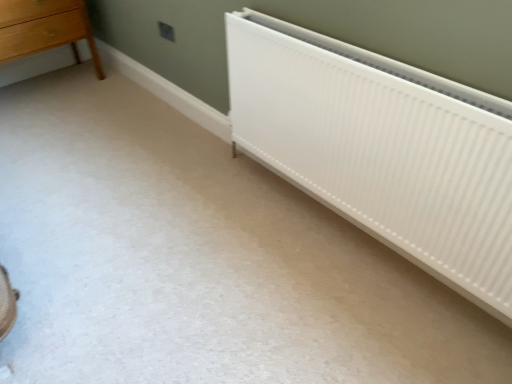
Question: Is white ribbed radiator at lower right far from light brown wooden chest of drawers at upper left?

Choices:
 (A) no
 (B) yes

Answer: (B)

Question: Considering the relative positions of white ribbed radiator at lower right and light brown wooden chest of drawers at upper left in the image provided, is white ribbed radiator at lower right to the left of light brown wooden chest of drawers at upper left from the viewer's perspective?

Choices:
 (A) no
 (B) yes

Answer: (A)

Question: Does white ribbed radiator at lower right have a larger size compared to light brown wooden chest of drawers at upper left?

Choices:
 (A) no
 (B) yes

Answer: (A)

Question: Is white ribbed radiator at lower right oriented towards light brown wooden chest of drawers at upper left?

Choices:
 (A) no
 (B) yes

Answer: (A)

Question: Considering the relative sizes of white ribbed radiator at lower right and light brown wooden chest of drawers at upper left in the image provided, is white ribbed radiator at lower right taller than light brown wooden chest of drawers at upper left?

Choices:
 (A) no
 (B) yes

Answer: (B)

Question: Considering the relative sizes of white ribbed radiator at lower right and light brown wooden chest of drawers at upper left in the image provided, is white ribbed radiator at lower right shorter than light brown wooden chest of drawers at upper left?

Choices:
 (A) yes
 (B) no

Answer: (B)

Question: Does light brown wooden chest of drawers at upper left have a larger size compared to white ribbed radiator at lower right?

Choices:
 (A) yes
 (B) no

Answer: (A)

Question: Can you confirm if light brown wooden chest of drawers at upper left is shorter than white ribbed radiator at lower right?

Choices:
 (A) no
 (B) yes

Answer: (B)

Question: Is light brown wooden chest of drawers at upper left in contact with white ribbed radiator at lower right?

Choices:
 (A) no
 (B) yes

Answer: (A)

Question: Is the depth of light brown wooden chest of drawers at upper left less than that of white ribbed radiator at lower right?

Choices:
 (A) no
 (B) yes

Answer: (A)

Question: From the image's perspective, is light brown wooden chest of drawers at upper left on top of white ribbed radiator at lower right?

Choices:
 (A) yes
 (B) no

Answer: (A)

Question: From the image's perspective, does light brown wooden chest of drawers at upper left appear lower than white ribbed radiator at lower right?

Choices:
 (A) yes
 (B) no

Answer: (B)

Question: Looking at their shapes, would you say white ribbed radiator at lower right is wider or thinner than light brown wooden chest of drawers at upper left?

Choices:
 (A) wide
 (B) thin

Answer: (B)